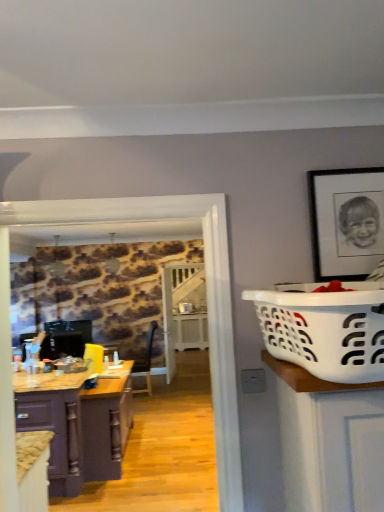
Question: From the image's perspective, would you say black matte picture frame at upper right is shown under matte purple cabinet at lower left, which is counted as the 1th cabinetry, starting from the front?

Choices:
 (A) yes
 (B) no

Answer: (B)

Question: Is black matte picture frame at upper right outside of matte purple cabinet at lower left, the 2th cabinetry when ordered from back to front?

Choices:
 (A) yes
 (B) no

Answer: (A)

Question: Is black matte picture frame at upper right bigger than matte purple cabinet at lower left, the 2th cabinetry when ordered from back to front?

Choices:
 (A) no
 (B) yes

Answer: (A)

Question: Considering the relative sizes of black matte picture frame at upper right and matte purple cabinet at lower left, which is counted as the 1th cabinetry, starting from the front, in the image provided, is black matte picture frame at upper right wider than matte purple cabinet at lower left, which is counted as the 1th cabinetry, starting from the front,?

Choices:
 (A) no
 (B) yes

Answer: (A)

Question: Is black matte picture frame at upper right facing towards matte purple cabinet at lower left, the 2th cabinetry when ordered from back to front?

Choices:
 (A) no
 (B) yes

Answer: (A)

Question: From a real-world perspective, relative to black matte picture frame at upper right, is purple wood cabinet at left, which appears as the second cabinetry when viewed from the front, vertically above or below?

Choices:
 (A) below
 (B) above

Answer: (A)

Question: From their relative heights in the image, would you say purple wood cabinet at left, acting as the 1th cabinetry starting from the back, is taller or shorter than black matte picture frame at upper right?

Choices:
 (A) tall
 (B) short

Answer: (A)

Question: Is point (38, 414) positioned closer to the camera than point (322, 249)?

Choices:
 (A) farther
 (B) closer

Answer: (A)

Question: From the image's perspective, is purple wood cabinet at left, acting as the 1th cabinetry starting from the back, above or below black matte picture frame at upper right?

Choices:
 (A) above
 (B) below

Answer: (B)

Question: Is matte purple cabinet at lower left, which is counted as the 1th cabinetry, starting from the front, spatially inside purple wood cabinet at left, acting as the 1th cabinetry starting from the back, or outside of it?

Choices:
 (A) outside
 (B) inside

Answer: (A)

Question: Visually, is matte purple cabinet at lower left, the 2th cabinetry when ordered from back to front, positioned to the left or to the right of purple wood cabinet at left, which appears as the second cabinetry when viewed from the front?

Choices:
 (A) right
 (B) left

Answer: (A)

Question: From the image's perspective, is matte purple cabinet at lower left, the 2th cabinetry when ordered from back to front, above or below purple wood cabinet at left, which appears as the second cabinetry when viewed from the front?

Choices:
 (A) below
 (B) above

Answer: (B)

Question: Looking at their shapes, would you say matte purple cabinet at lower left, which is counted as the 1th cabinetry, starting from the front, is wider or thinner than purple wood cabinet at left, which appears as the second cabinetry when viewed from the front?

Choices:
 (A) wide
 (B) thin

Answer: (B)

Question: From the image's perspective, is black matte picture frame at upper right above or below matte purple cabinet at lower left, the 2th cabinetry when ordered from back to front?

Choices:
 (A) below
 (B) above

Answer: (B)

Question: From a real-world perspective, is black matte picture frame at upper right above or below matte purple cabinet at lower left, which is counted as the 1th cabinetry, starting from the front?

Choices:
 (A) above
 (B) below

Answer: (A)